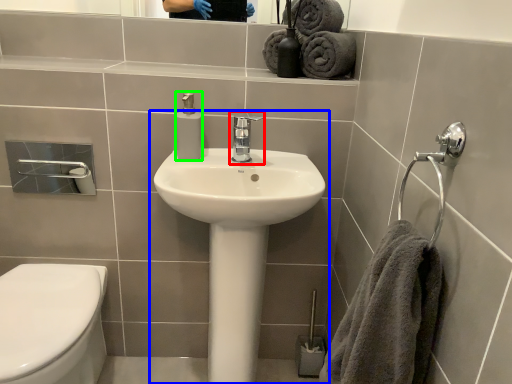
Question: Based on their relative distances, which object is farther from tap (highlighted by a red box)? Choose from sink (highlighted by a blue box) and soap dispenser (highlighted by a green box).

Choices:
 (A) sink
 (B) soap dispenser

Answer: (A)